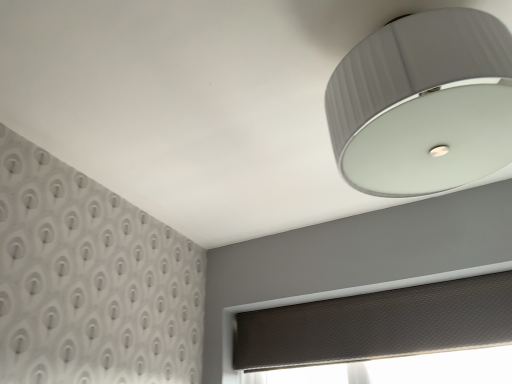
What do you see at coordinates (423, 104) in the screenshot? I see `matte gray lampshade at upper right` at bounding box center [423, 104].

At what (x,y) coordinates should I click in order to perform the action: click on matte gray lampshade at upper right. Please return your answer as a coordinate pair (x, y). This screenshot has height=384, width=512. Looking at the image, I should click on [423, 104].

Where is `matte gray lampshade at upper right`? The height and width of the screenshot is (384, 512). matte gray lampshade at upper right is located at coordinates (423, 104).